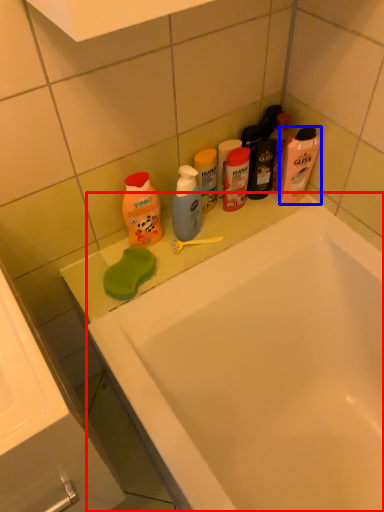
Question: Which object is closer to the camera taking this photo, bathtub (highlighted by a red box) or cleaning product (highlighted by a blue box)?

Choices:
 (A) bathtub
 (B) cleaning product

Answer: (A)